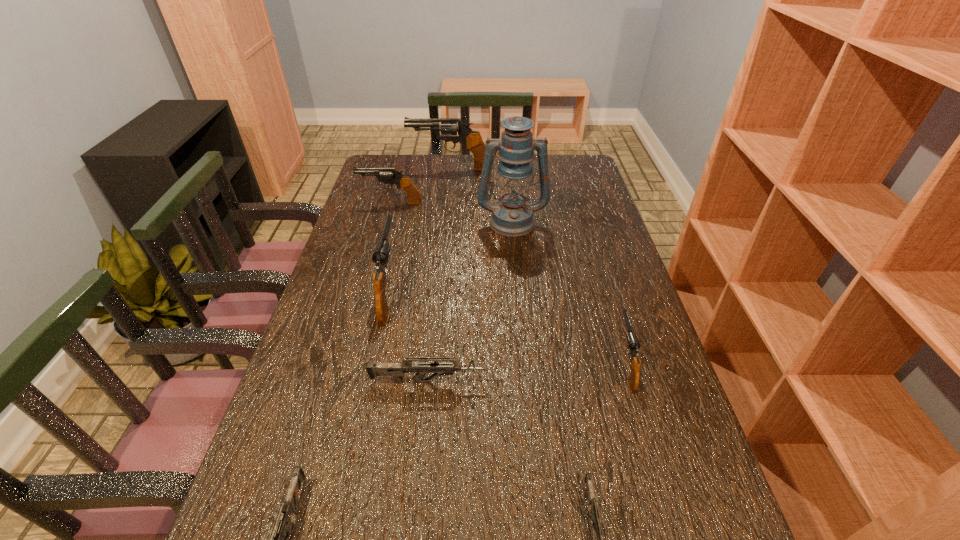
Where is `free location located aimed along the barrel of the biggest grey gun`? The image size is (960, 540). free location located aimed along the barrel of the biggest grey gun is located at coordinates (633, 381).

Where is `object positioned at the far edge`? The image size is (960, 540). object positioned at the far edge is located at coordinates (472, 140).

You are a GUI agent. You are given a task and a screenshot of the screen. Output one action in this format:
    pyautogui.click(x=<x>, y=<y>)
    Task: Click on the object present at the right edge
    
    Given the screenshot: What is the action you would take?
    pyautogui.click(x=633, y=344)

Locate an element on the screen. The width and height of the screenshot is (960, 540). object that is at the far left corner is located at coordinates (472, 140).

Identify the location of vacant space at the far edge. (440, 173).

I want to click on free space at the left edge of the desktop, so click(352, 233).

This screenshot has height=540, width=960. In order to click on blank area at the right edge in this screenshot , I will do `click(667, 438)`.

Where is `free region at the far right corner of the desktop`? The image size is (960, 540). free region at the far right corner of the desktop is located at coordinates (563, 165).

Where is `free space between the third farthest gun and the sixth nearest object`? free space between the third farthest gun and the sixth nearest object is located at coordinates (450, 255).

This screenshot has height=540, width=960. In order to click on free space between the second tallest object and the third farthest black gun in this screenshot , I will do `click(420, 229)`.